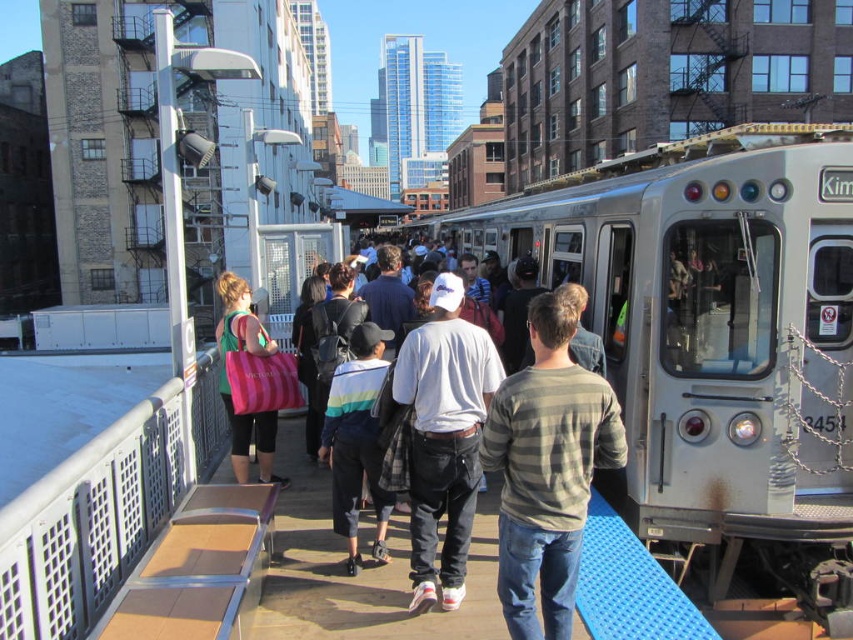
Can you confirm if striped cotton shirt at center is positioned to the right of white matte cap at center?

Yes, striped cotton shirt at center is to the right of white matte cap at center.

Which is behind, point (613, 412) or point (410, 483)?

Positioned behind is point (410, 483).

You are a GUI agent. You are given a task and a screenshot of the screen. Output one action in this format:
    pyautogui.click(x=<x>, y=<y>)
    Task: Click on the striped cotton shirt at center
    This screenshot has height=640, width=853.
    Given the screenshot: What is the action you would take?
    pyautogui.click(x=547, y=468)

Locate an element on the screen. The image size is (853, 640). striped cotton shirt at center is located at coordinates (547, 468).

Is silver metallic train at center positioned in front of white matte cap at center?

No, it is behind white matte cap at center.

Which is in front, point (610, 308) or point (416, 468)?

Positioned in front is point (416, 468).

Find the location of a particular element. The image size is (853, 640). silver metallic train at center is located at coordinates (715, 337).

Can you confirm if striped cotton shirt at center is thinner than striped shirt at center?

Correct, striped cotton shirt at center's width is less than striped shirt at center's.

The image size is (853, 640). In order to click on striped cotton shirt at center in this screenshot , I will do `click(547, 468)`.

Is point (567, 385) closer to camera compared to point (376, 589)?

Yes, it is.

Where is `striped cotton shirt at center`? Image resolution: width=853 pixels, height=640 pixels. striped cotton shirt at center is located at coordinates coord(547,468).